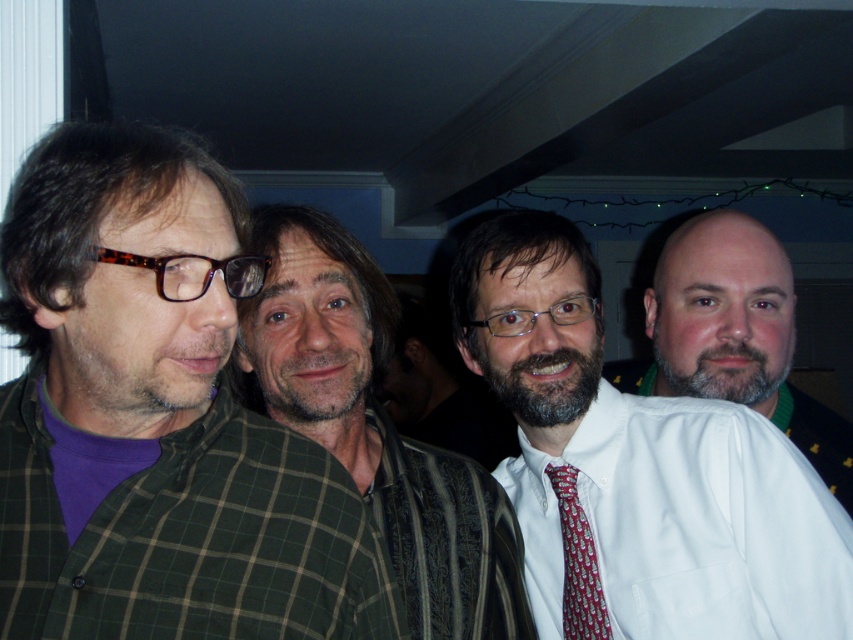
How much distance is there between green plaid shirt at center and white shirt at right?

They are 21.96 inches apart.

Is point (260, 237) positioned in front of point (714, 224)?

That is True.

Who is more distant from viewer, (x=486, y=493) or (x=844, y=468)?

The point (x=844, y=468) is behind.

Find the location of a particular element. green plaid shirt at center is located at coordinates (375, 426).

Is white smooth dress shirt at center positioned at the back of green plaid shirt at center?

Yes.

Is white smooth dress shirt at center bigger than green plaid shirt at center?

No.

Who is more distant from viewer, (631, 554) or (477, 499)?

Point (477, 499)

Where is `white smooth dress shirt at center`? The width and height of the screenshot is (853, 640). white smooth dress shirt at center is located at coordinates (688, 524).

Which is below, green plaid shirt at left or white shirt at right?

green plaid shirt at left is lower down.

Is green plaid shirt at left above white shirt at right?

Incorrect, green plaid shirt at left is not positioned above white shirt at right.

Where is `green plaid shirt at left`? green plaid shirt at left is located at coordinates (160, 420).